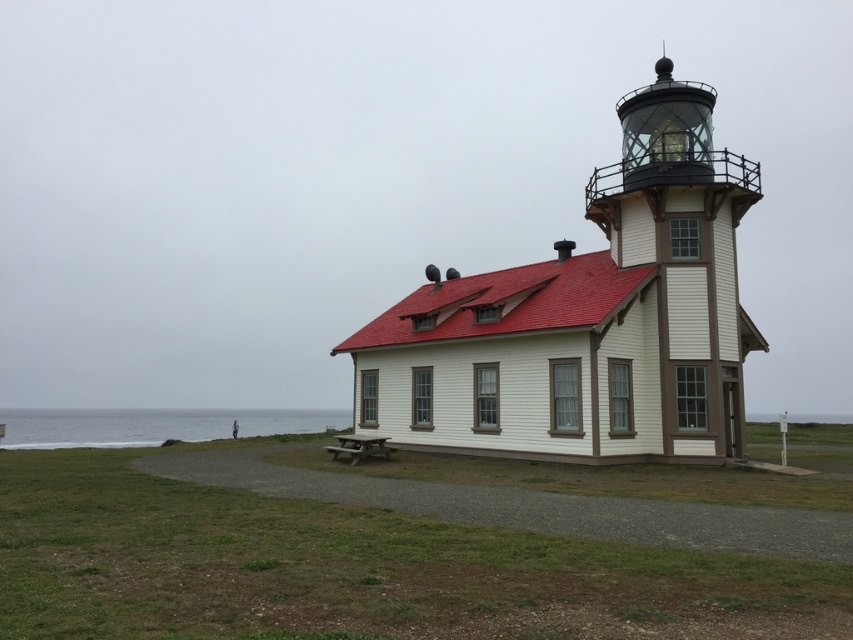
The image size is (853, 640). What do you see at coordinates (683, 253) in the screenshot? I see `matte white tower at center` at bounding box center [683, 253].

Who is higher up, matte white tower at center or wooden picnic table at center?

matte white tower at center is above.

Locate an element on the screen. This screenshot has height=640, width=853. matte white tower at center is located at coordinates (683, 253).

Image resolution: width=853 pixels, height=640 pixels. In order to click on matte white tower at center in this screenshot , I will do `click(683, 253)`.

From the picture: Between gray water at lower left and wooden picnic table at center, which one is positioned lower?

gray water at lower left is lower down.

Who is shorter, gray water at lower left or wooden picnic table at center?

Standing shorter between the two is wooden picnic table at center.

Describe the element at coordinates (154, 426) in the screenshot. The image size is (853, 640). I see `gray water at lower left` at that location.

This screenshot has width=853, height=640. I want to click on gray water at lower left, so click(x=154, y=426).

Between matte white tower at center and gray water at lower left, which one is positioned lower?

Positioned lower is gray water at lower left.

Is point (692, 310) more distant than point (199, 432)?

No, (692, 310) is closer to viewer.

You are a GUI agent. You are given a task and a screenshot of the screen. Output one action in this format:
    pyautogui.click(x=<x>, y=<y>)
    Task: Click on the matte white tower at center
    The height and width of the screenshot is (640, 853).
    Given the screenshot: What is the action you would take?
    pyautogui.click(x=683, y=253)